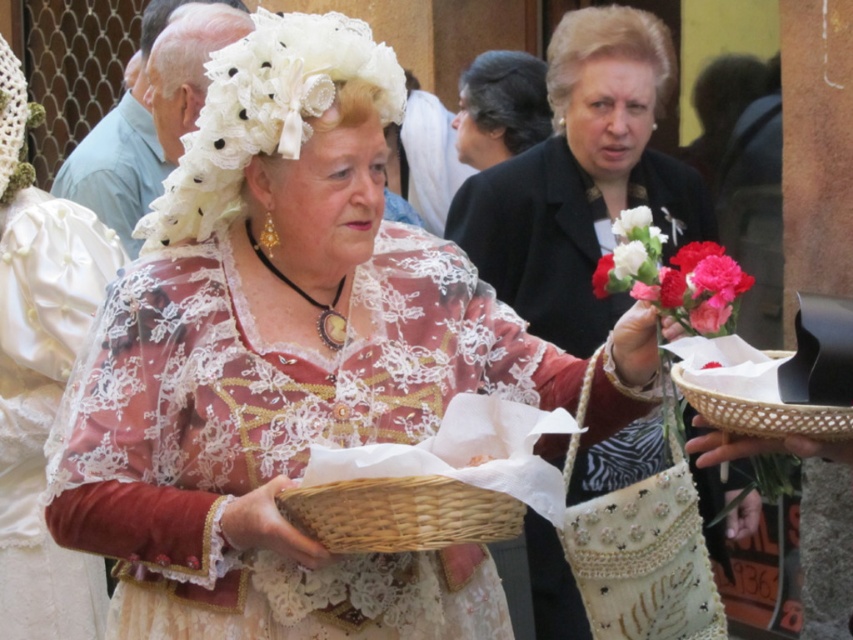
You are a photographer at the event and need to frame both the matte black coat at center and the smooth silk bouquet at center in your shot. Which object is narrower so you can position it closer to the edge of the frame?

The matte black coat at center is narrower than the smooth silk bouquet at center, so you can position it closer to the edge of the frame.

You are organizing a small event and need to place a decorative item in the woven straw basket at center. Considering the size of the dark brown hair at center, will the basket be large enough to hold a small bouquet of flowers?

The woven straw basket at center has a smaller size compared to dark brown hair at center. Since the basket is smaller, it may not be large enough to hold a small bouquet of flowers unless the bouquet is significantly smaller than the hair.